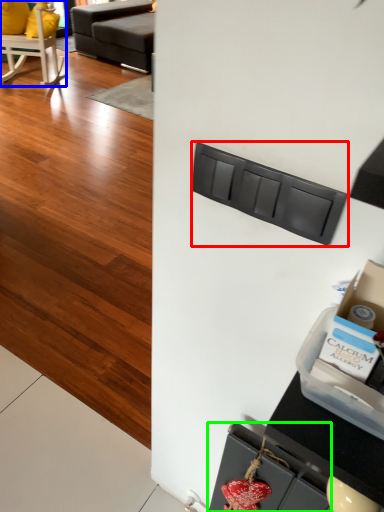
Question: Which object is positioned closest to drawer (highlighted by a red box)? Select from chair (highlighted by a blue box) and drawer (highlighted by a green box).

Choices:
 (A) chair
 (B) drawer

Answer: (B)